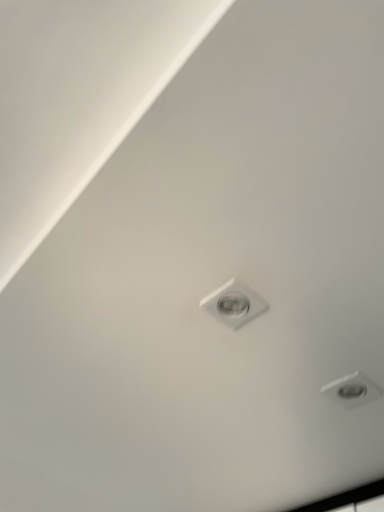
Question: Relative to white glossy light bulb at center, is matte white droplight at lower right in front or behind?

Choices:
 (A) behind
 (B) front

Answer: (A)

Question: From the image's perspective, is matte white droplight at lower right above or below white glossy light bulb at center?

Choices:
 (A) below
 (B) above

Answer: (A)

Question: In the image, is matte white droplight at lower right on the left side or the right side of white glossy light bulb at center?

Choices:
 (A) left
 (B) right

Answer: (B)

Question: Is white glossy light bulb at center in front of or behind matte white droplight at lower right in the image?

Choices:
 (A) behind
 (B) front

Answer: (B)

Question: From the image's perspective, is white glossy light bulb at center located above or below matte white droplight at lower right?

Choices:
 (A) above
 (B) below

Answer: (A)

Question: Considering the positions of white glossy light bulb at center and matte white droplight at lower right in the image, is white glossy light bulb at center taller or shorter than matte white droplight at lower right?

Choices:
 (A) short
 (B) tall

Answer: (B)

Question: In terms of size, does white glossy light bulb at center appear bigger or smaller than matte white droplight at lower right?

Choices:
 (A) big
 (B) small

Answer: (A)